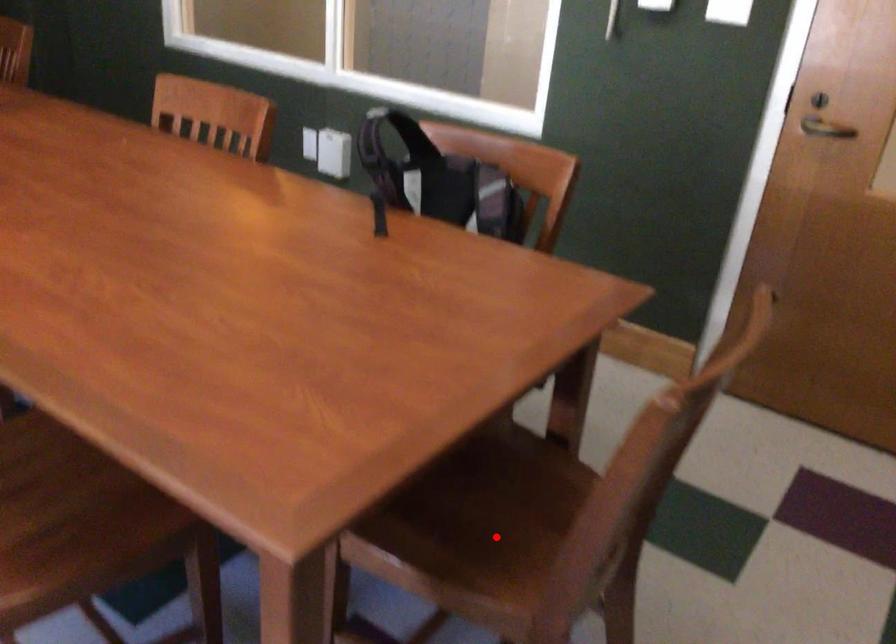
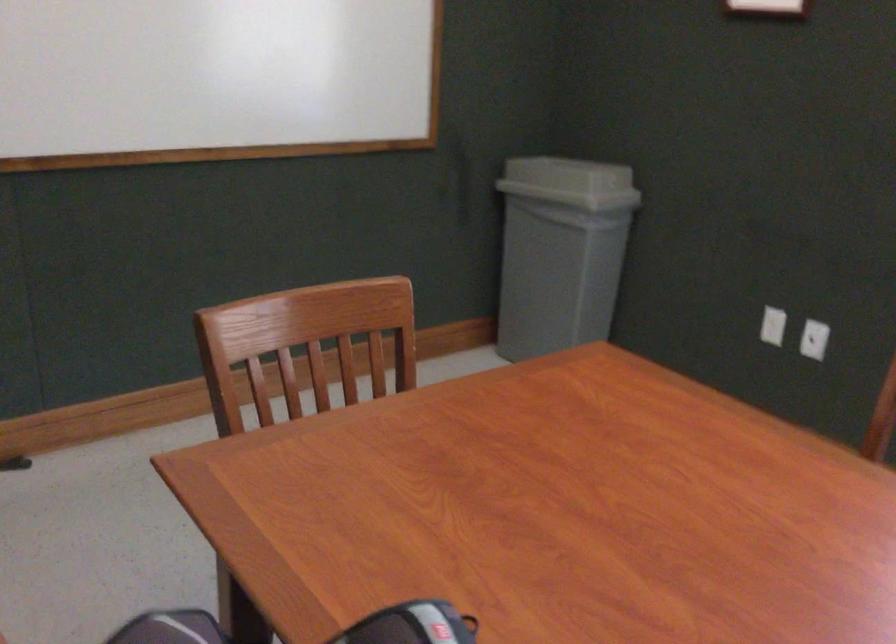
Question: I am providing you with two images of the same scene from different viewpoints. A red point is marked on the first image. Is the red point's position out of view in image 2?

Choices:
 (A) Yes
 (B) No

Answer: (A)